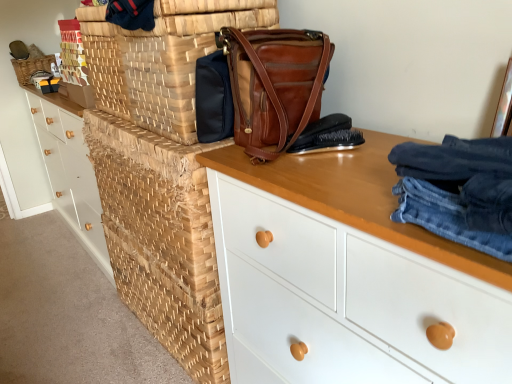
I want to click on white matte chest of drawers at center, positioned as the first chest of drawers in front-to-back order, so click(x=347, y=276).

Image resolution: width=512 pixels, height=384 pixels. Describe the element at coordinates (347, 276) in the screenshot. I see `white matte chest of drawers at center, which is the 2th chest of drawers from left to right` at that location.

What do you see at coordinates (31, 67) in the screenshot? I see `natural woven basket at upper left, the second basket positioned from the bottom` at bounding box center [31, 67].

In order to click on brown leather handbag at center in this screenshot , I will do `click(275, 86)`.

Describe the element at coordinates (161, 59) in the screenshot. I see `brown woven basket at center, which is the 2th basket from top to bottom` at that location.

What do you see at coordinates (330, 142) in the screenshot? Image resolution: width=512 pixels, height=384 pixels. I see `brown leather brush at center` at bounding box center [330, 142].

Image resolution: width=512 pixels, height=384 pixels. In order to click on white matte chest of drawers at center, which is the 2th chest of drawers from left to right in this screenshot , I will do `click(347, 276)`.

Is woven wood basket at center far away from brown leather brush at center?

No, there isn't a large distance between woven wood basket at center and brown leather brush at center.

Considering the positions of objects woven wood basket at center and brown leather brush at center in the image provided, who is more to the right, woven wood basket at center or brown leather brush at center?

Positioned to the right is brown leather brush at center.

From a real-world perspective, is woven wood basket at center beneath brown leather brush at center?

Yes, from a real-world perspective, woven wood basket at center is below brown leather brush at center.

Is woven wood chest of drawers at left, acting as the 2th chest of drawers starting from the front, located within white matte chest of drawers at center, which is counted as the 2th chest of drawers, starting from the back?

No, woven wood chest of drawers at left, acting as the 2th chest of drawers starting from the front, is not surrounded by white matte chest of drawers at center, which is counted as the 2th chest of drawers, starting from the back.

Locate an element on the screen. Image resolution: width=512 pixels, height=384 pixels. chest of drawers located on the left of white matte chest of drawers at center, which is counted as the 2th chest of drawers, starting from the back is located at coordinates (70, 170).

Is white matte chest of drawers at center, which appears as the first chest of drawers when viewed from the right, aimed at woven wood chest of drawers at left, the 1th chest of drawers in the back-to-front sequence?

No, white matte chest of drawers at center, which appears as the first chest of drawers when viewed from the right, is not aimed at woven wood chest of drawers at left, the 1th chest of drawers in the back-to-front sequence.

From a real-world perspective, which is physically above, white matte chest of drawers at center, positioned as the first chest of drawers in front-to-back order, or brown leather handbag at center?

brown leather handbag at center, from a real-world perspective.

Could you tell me if white matte chest of drawers at center, which is counted as the 2th chest of drawers, starting from the back, is facing brown leather handbag at center?

No, white matte chest of drawers at center, which is counted as the 2th chest of drawers, starting from the back, is not facing towards brown leather handbag at center.

Are white matte chest of drawers at center, which is counted as the 2th chest of drawers, starting from the back, and brown leather handbag at center far apart?

That's not correct — white matte chest of drawers at center, which is counted as the 2th chest of drawers, starting from the back, is a little close to brown leather handbag at center.

At what (x,y) coordinates should I click in order to perform the action: click on the 2nd chest of drawers below when counting from the brown leather handbag at center (from the image's perspective). Please return your answer as a coordinate pair (x, y). Image resolution: width=512 pixels, height=384 pixels. Looking at the image, I should click on (347, 276).

Can you confirm if brown leather brush at center is thinner than woven wood chest of drawers at left, acting as the 2th chest of drawers starting from the front?

Yes.

You are a GUI agent. You are given a task and a screenshot of the screen. Output one action in this format:
    pyautogui.click(x=<x>, y=<y>)
    Task: Click on the shoe lying on the right of woven wood chest of drawers at left, the 1th chest of drawers in the back-to-front sequence
    The image size is (512, 384).
    Given the screenshot: What is the action you would take?
    pyautogui.click(x=330, y=142)

From a real-world perspective, between brown leather brush at center and woven wood chest of drawers at left, marked as the first chest of drawers in a left-to-right arrangement, who is vertically higher?

brown leather brush at center.

From the image's perspective, is brown leather brush at center above or below woven wood chest of drawers at left, marked as the first chest of drawers in a left-to-right arrangement?

brown leather brush at center is situated lower than woven wood chest of drawers at left, marked as the first chest of drawers in a left-to-right arrangement, in the image.

You are a GUI agent. You are given a task and a screenshot of the screen. Output one action in this format:
    pyautogui.click(x=<x>, y=<y>)
    Task: Click on the basket above the brown woven basket at center, the 1th basket positioned from the bottom (from the image's perspective)
    The height and width of the screenshot is (384, 512).
    Given the screenshot: What is the action you would take?
    pyautogui.click(x=31, y=67)

From the image's perspective, is natural woven basket at upper left, positioned as the first basket in left-to-right order, located above brown woven basket at center, which is the 2th basket from top to bottom?

Yes.

Considering the positions of objects natural woven basket at upper left, which appears as the 2th basket when viewed from the right, and brown woven basket at center, which is the 2th basket from top to bottom, in the image provided, who is in front, natural woven basket at upper left, which appears as the 2th basket when viewed from the right, or brown woven basket at center, which is the 2th basket from top to bottom,?

brown woven basket at center, which is the 2th basket from top to bottom, is closer to the camera.

From the picture: Is natural woven basket at upper left, the second basket positioned from the bottom, facing away from brown woven basket at center, arranged as the first basket when viewed from the front?

natural woven basket at upper left, the second basket positioned from the bottom, is not turned away from brown woven basket at center, arranged as the first basket when viewed from the front.

In the scene shown: Is natural woven basket at upper left, the first basket in the top-to-bottom sequence, not near woven wood chest of drawers at left, positioned as the second chest of drawers in right-to-left order?

They are positioned close to each other.

From the image's perspective, who appears lower, natural woven basket at upper left, the first basket in the top-to-bottom sequence, or woven wood chest of drawers at left, acting as the 2th chest of drawers starting from the front?

woven wood chest of drawers at left, acting as the 2th chest of drawers starting from the front, appears lower in the image.

Is natural woven basket at upper left, the second basket when ordered from front to back, bigger or smaller than woven wood chest of drawers at left, marked as the first chest of drawers in a left-to-right arrangement?

Clearly, natural woven basket at upper left, the second basket when ordered from front to back, is smaller in size than woven wood chest of drawers at left, marked as the first chest of drawers in a left-to-right arrangement.

Can you confirm if natural woven basket at upper left, the second basket when ordered from front to back, is positioned to the left of woven wood chest of drawers at left, positioned as the second chest of drawers in right-to-left order?

Correct, you'll find natural woven basket at upper left, the second basket when ordered from front to back, to the left of woven wood chest of drawers at left, positioned as the second chest of drawers in right-to-left order.

Based on the photo, is woven wood basket at center oriented towards brown leather handbag at center?

No.

From the picture: Does woven wood basket at center have a lesser height compared to brown leather handbag at center?

In fact, woven wood basket at center may be taller than brown leather handbag at center.

The image size is (512, 384). I want to click on crate behind the brown leather handbag at center, so click(161, 239).

From the image's perspective, is woven wood basket at center under brown leather handbag at center?

Yes, from the image's perspective, woven wood basket at center is below brown leather handbag at center.

At what (x,y) coordinates should I click in order to perform the action: click on shoe in front of the woven wood basket at center. Please return your answer as a coordinate pair (x, y). The width and height of the screenshot is (512, 384). Looking at the image, I should click on [330, 142].

Identify the location of the chest of drawers that appears behind the white matte chest of drawers at center, positioned as the first chest of drawers in front-to-back order. click(70, 170).

Considering their positions, is white matte chest of drawers at center, which is the 2th chest of drawers from left to right, positioned closer to brown woven basket at center, which is the 2th basket from top to bottom, than brown leather brush at center?

Among the two, white matte chest of drawers at center, which is the 2th chest of drawers from left to right, is located nearer to brown woven basket at center, which is the 2th basket from top to bottom.

Considering their positions, is woven wood chest of drawers at left, marked as the first chest of drawers in a left-to-right arrangement, positioned further to natural woven basket at upper left, the first basket in the top-to-bottom sequence, than brown leather brush at center?

brown leather brush at center is further to natural woven basket at upper left, the first basket in the top-to-bottom sequence.

Estimate the real-world distances between objects in this image. Which object is closer to woven wood chest of drawers at left, acting as the 2th chest of drawers starting from the front, brown woven basket at center, marked as the 2th basket in a left-to-right arrangement, or brown leather handbag at center?

The object closer to woven wood chest of drawers at left, acting as the 2th chest of drawers starting from the front, is brown woven basket at center, marked as the 2th basket in a left-to-right arrangement.

When comparing their distances from brown woven basket at center, the 1th basket when ordered from right to left, does brown leather brush at center or natural woven basket at upper left, which is counted as the 1th basket, starting from the back, seem closer?

Among the two, brown leather brush at center is located nearer to brown woven basket at center, the 1th basket when ordered from right to left.

Based on the photo, which object lies nearer to the anchor point woven wood chest of drawers at left, acting as the 2th chest of drawers starting from the front, brown woven basket at center, arranged as the first basket when viewed from the front, or brown leather brush at center?

Among the two, brown woven basket at center, arranged as the first basket when viewed from the front, is located nearer to woven wood chest of drawers at left, acting as the 2th chest of drawers starting from the front.

Which object lies nearer to the anchor point white matte chest of drawers at center, positioned as the first chest of drawers in front-to-back order, natural woven basket at upper left, which is counted as the 1th basket, starting from the back, or woven wood chest of drawers at left, positioned as the second chest of drawers in right-to-left order?

woven wood chest of drawers at left, positioned as the second chest of drawers in right-to-left order.

From the image, which object appears to be nearer to natural woven basket at upper left, which appears as the 2th basket when viewed from the right, white matte chest of drawers at center, which appears as the first chest of drawers when viewed from the right, or woven wood basket at center?

The object closer to natural woven basket at upper left, which appears as the 2th basket when viewed from the right, is woven wood basket at center.

From the image, which object appears to be farther from natural woven basket at upper left, positioned as the first basket in left-to-right order, brown leather brush at center or woven wood basket at center?

Among the two, brown leather brush at center is located further to natural woven basket at upper left, positioned as the first basket in left-to-right order.

What are the coordinates of `crate between brown leather handbag at center and white matte chest of drawers at center, positioned as the first chest of drawers in front-to-back order, vertically` in the screenshot? It's located at 161,239.

Find the location of a particular element. crate located between white matte chest of drawers at center, positioned as the first chest of drawers in front-to-back order, and natural woven basket at upper left, the second basket when ordered from front to back, in the depth direction is located at coordinates (161, 239).

The image size is (512, 384). What are the coordinates of `shoe positioned between brown leather handbag at center and natural woven basket at upper left, the first basket in the top-to-bottom sequence, from near to far` in the screenshot? It's located at (330, 142).

The image size is (512, 384). Identify the location of crate between brown woven basket at center, the 1th basket when ordered from right to left, and white matte chest of drawers at center, which is the 2th chest of drawers from left to right, vertically. (161, 239).